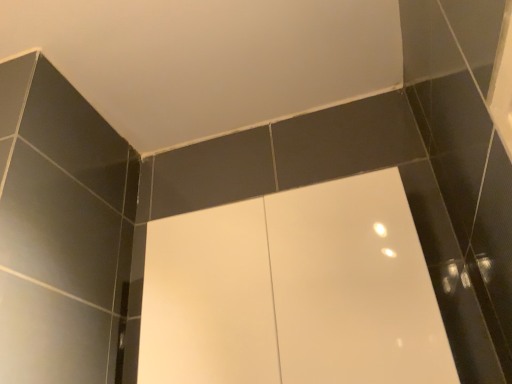
This screenshot has width=512, height=384. What do you see at coordinates (293, 291) in the screenshot?
I see `white glossy door at center` at bounding box center [293, 291].

You are a GUI agent. You are given a task and a screenshot of the screen. Output one action in this format:
    pyautogui.click(x=<x>, y=<y>)
    Task: Click on the white glossy door at center
    The height and width of the screenshot is (384, 512).
    Given the screenshot: What is the action you would take?
    pyautogui.click(x=293, y=291)

At what (x,y) coordinates should I click in order to perform the action: click on white glossy door at center. Please return your answer as a coordinate pair (x, y). Looking at the image, I should click on (293, 291).